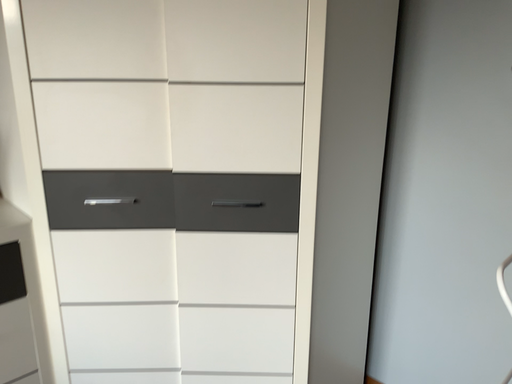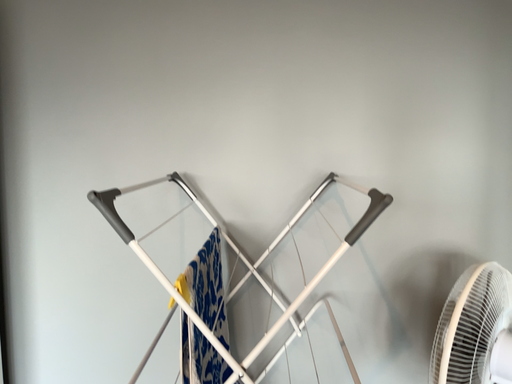
Question: How did the camera likely rotate when shooting the video?

Choices:
 (A) rotated upward
 (B) rotated downward

Answer: (A)